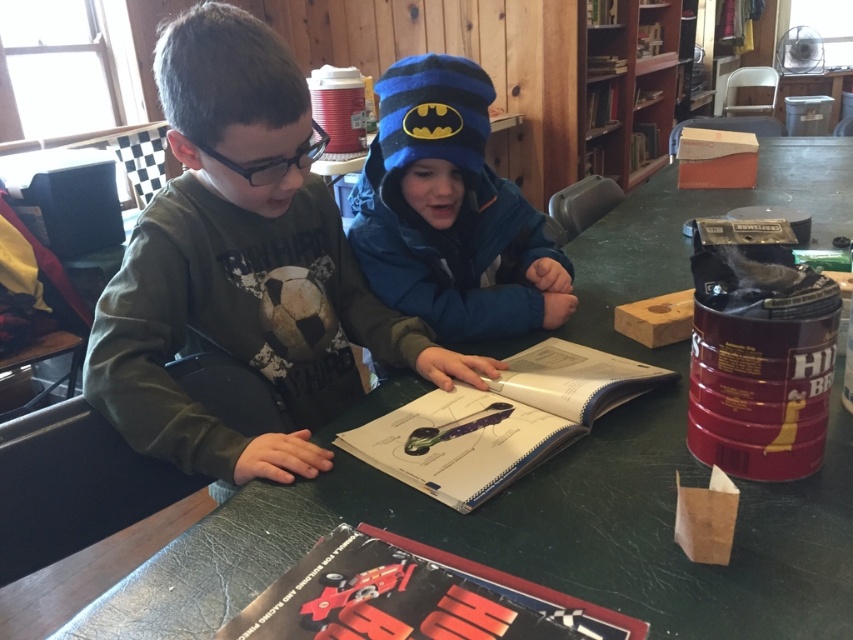
Can you confirm if green matte shirt at left is thinner than white paper book at center?

Incorrect, green matte shirt at left's width is not less than white paper book at center's.

Between point (209, 220) and point (425, 483), which one is positioned behind?

Point (209, 220)

Is point (129, 365) positioned after point (358, 433)?

No.

Where is `green matte shirt at left`? Image resolution: width=853 pixels, height=640 pixels. green matte shirt at left is located at coordinates (242, 266).

Between red glossy book at center and wooden bookshelf at upper center, which one appears on the left side from the viewer's perspective?

red glossy book at center

You are a GUI agent. You are given a task and a screenshot of the screen. Output one action in this format:
    pyautogui.click(x=<x>, y=<y>)
    Task: Click on the red glossy book at center
    This screenshot has height=640, width=853.
    Given the screenshot: What is the action you would take?
    pyautogui.click(x=413, y=598)

Is red glossy book at center positioned behind white paper book at center?

No, red glossy book at center is in front of white paper book at center.

Is point (456, 632) positioned behind point (521, 404)?

No, (456, 632) is in front of (521, 404).

Which is behind, point (347, 604) or point (448, 410)?

The point (448, 410) is behind.

Where is `red glossy book at center`? The height and width of the screenshot is (640, 853). red glossy book at center is located at coordinates (413, 598).